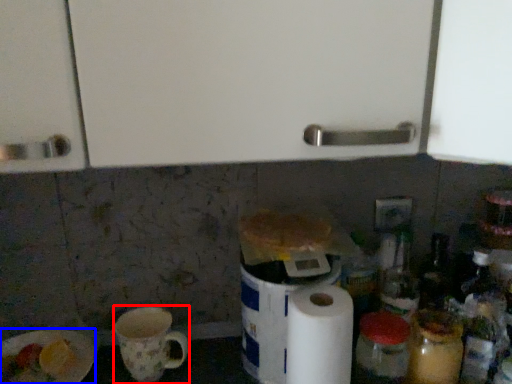
Question: Which object is closer to the camera taking this photo, mug (highlighted by a red box) or paper plate (highlighted by a blue box)?

Choices:
 (A) mug
 (B) paper plate

Answer: (B)